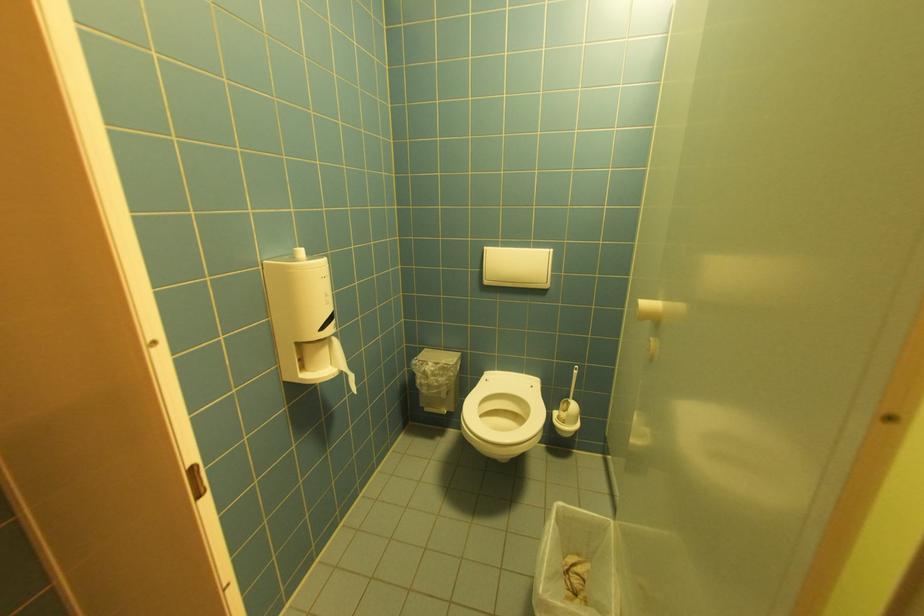
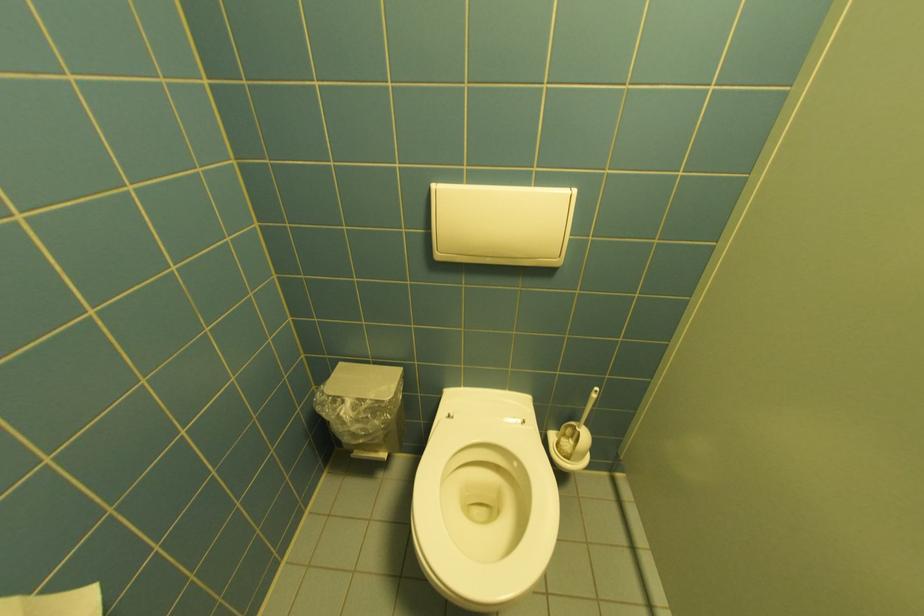
Find the pixel in the second image that matches (432,350) in the first image.

(347, 365)